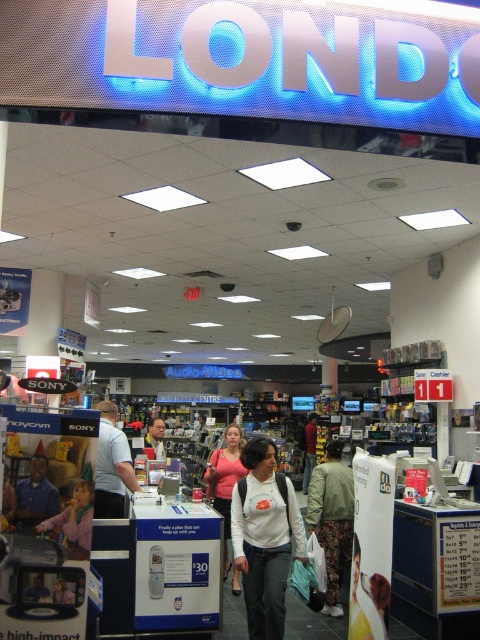
You are a store employee organizing a display. You need to place a new rectangular box that is 20 cm wide. The box must fit between the white matte shirt at center and the matte blue shirt at lower left. Can the box fit there based on their widths?

The white matte shirt at center might be wider than matte blue shirt at lower left, so the total width between them could accommodate the 20 cm box. However, since the exact width difference isn not specified, it is uncertain if there is enough space. Check the actual measurements before placing the box.

You are standing at the point marked as point (250, 442) in the store. The store has a checkout counter located 15 feet away from where you are standing. Can you reach the checkout counter from your current position without moving more than 15 feet?

The distance between point (250, 442) and the viewer is 14.42 feet, which is less than 15 feet. Therefore, you can reach the checkout counter without moving more than 15 feet.

You are standing at the entrance of the store and see the point labeled as point [332,518]. What item is located at that point?

The point [332,518] corresponds to the floral patterned pants at center.